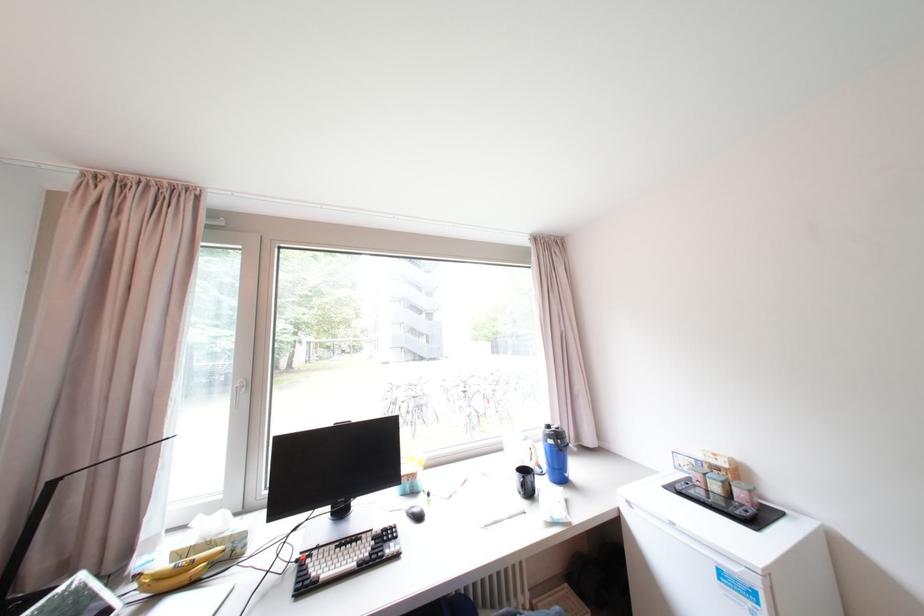
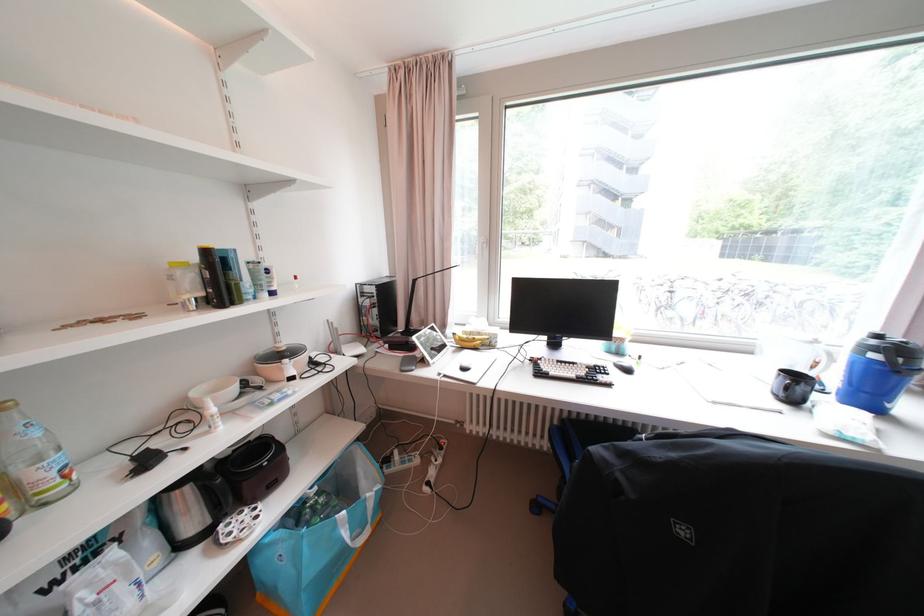
Locate, in the second image, the point that corresponds to the point at 567,442 in the first image.

(909, 361)